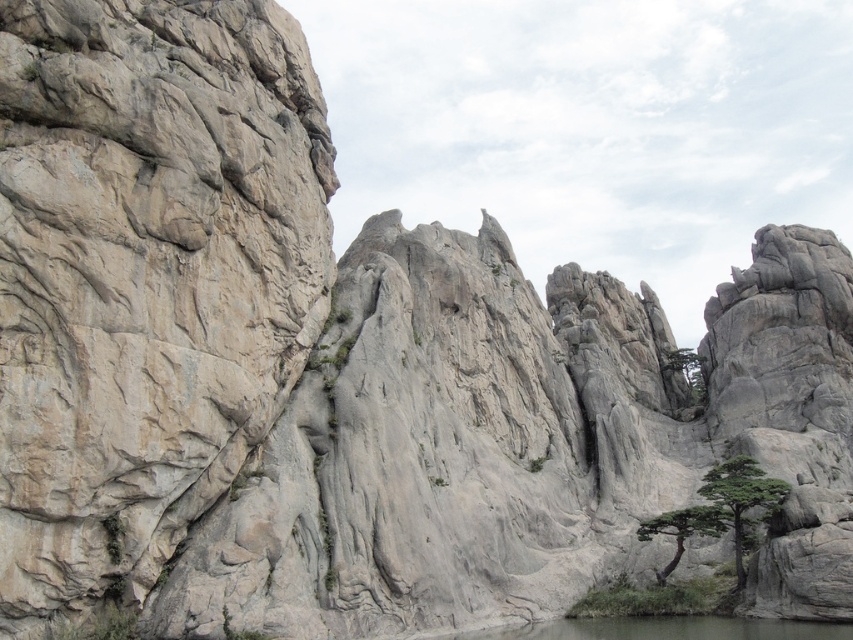
Which is more to the left, clear water at lower center or green textured rock at lower right?

clear water at lower center

Which is more to the right, clear water at lower center or green textured rock at lower right?

green textured rock at lower right

Describe the element at coordinates (666, 628) in the screenshot. I see `clear water at lower center` at that location.

What are the coordinates of `clear water at lower center` in the screenshot? It's located at (666, 628).

Which is more to the left, clear water at lower center or green textured tree at lower right?

From the viewer's perspective, clear water at lower center appears more on the left side.

Does clear water at lower center have a smaller size compared to green textured tree at lower right?

Actually, clear water at lower center might be larger than green textured tree at lower right.

Where is `clear water at lower center`? clear water at lower center is located at coordinates (666, 628).

I want to click on clear water at lower center, so click(x=666, y=628).

Which of these two, green textured rock at lower right or green textured tree at lower right, stands taller?

green textured rock at lower right is taller.

Can you confirm if green textured rock at lower right is positioned to the left of green textured tree at lower right?

In fact, green textured rock at lower right is to the right of green textured tree at lower right.

You are a GUI agent. You are given a task and a screenshot of the screen. Output one action in this format:
    pyautogui.click(x=<x>, y=<y>)
    Task: Click on the green textured rock at lower right
    This screenshot has height=640, width=853.
    Given the screenshot: What is the action you would take?
    pyautogui.click(x=741, y=496)